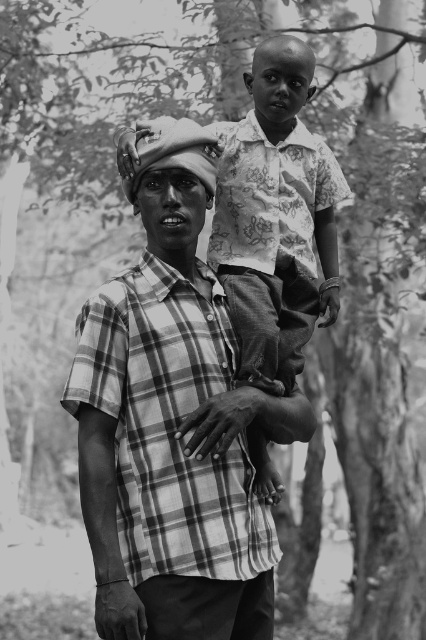
You are a fashion designer analyzing clothing items in an image. You notice two shirts in the scene. The first is a plaid fabric shirt at center, and the second is a patterned fabric shirt at upper center. Which of these two shirts appears taller in the image?

The plaid fabric shirt at center appears taller than the patterned fabric shirt at upper center in the image.

You are a photographer analyzing this image. You notice the plaid fabric shirt at center and the patterned fabric shirt at upper center. Which shirt is closer to the camera?

The plaid fabric shirt at center is closer to the camera because it is in front of the patterned fabric shirt at upper center.

You are a photographer analyzing this scene. You notice the plaid fabric shirt at center and the patterned fabric shirt at upper center. Which shirt is positioned to the right side of the other?

The plaid fabric shirt at center is to the left of patterned fabric shirt at upper center, so the patterned fabric shirt at upper center is positioned to the right side of the plaid fabric shirt at center.